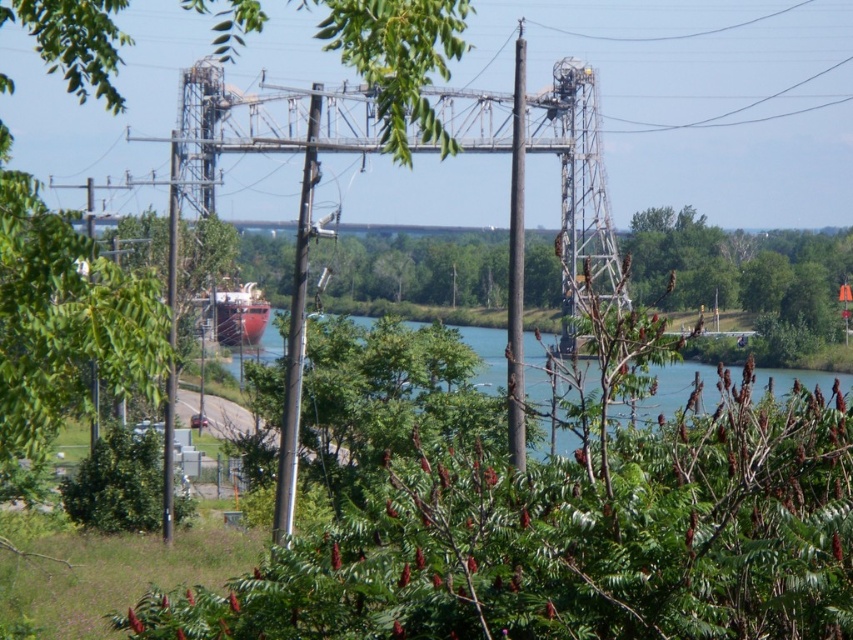
Does point (532, 362) lie in front of point (520, 390)?

That is False.

This screenshot has width=853, height=640. What do you see at coordinates (677, 387) in the screenshot?
I see `green water at center` at bounding box center [677, 387].

What are the coordinates of `green water at center` in the screenshot? It's located at (677, 387).

Between green water at center and metallic gray pole at left, which one has less height?

Result: With less height is green water at center.

I want to click on green water at center, so click(677, 387).

Is point (660, 408) positioned in front of point (213, 300)?

Yes, point (660, 408) is in front of point (213, 300).

Is green water at center shorter than shiny red ship at center?

Incorrect, green water at center's height does not fall short of shiny red ship at center's.

The image size is (853, 640). What do you see at coordinates (677, 387) in the screenshot?
I see `green water at center` at bounding box center [677, 387].

The height and width of the screenshot is (640, 853). Identify the location of green water at center. (677, 387).